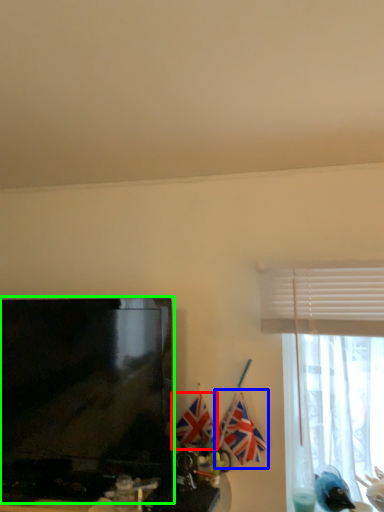
Question: Which object is positioned farthest from flag (highlighted by a red box)? Select from flag (highlighted by a blue box) and television (highlighted by a green box).

Choices:
 (A) flag
 (B) television

Answer: (B)